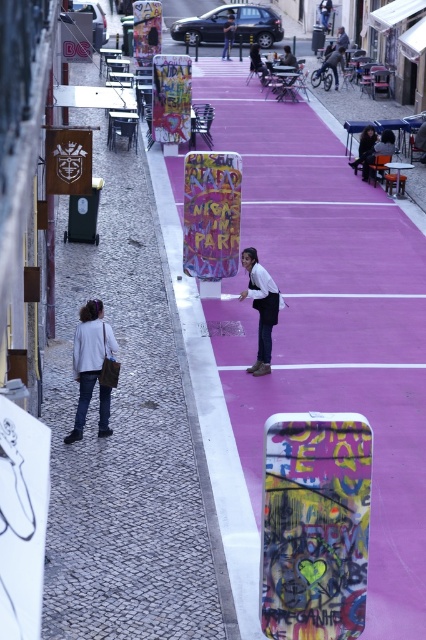
Can you confirm if white shirt at center is shorter than dark blue jeans at center?

Correct, white shirt at center is not as tall as dark blue jeans at center.

Which is in front, point (273, 305) or point (222, 49)?

Positioned in front is point (273, 305).

Which is behind, point (264, 332) or point (227, 32)?

Point (227, 32)

At what (x,y) coordinates should I click in order to perform the action: click on white shirt at center. Please return your answer as a coordinate pair (x, y). The image size is (426, 640). Looking at the image, I should click on (261, 307).

Can you confirm if white matte jacket at lower left is positioned below matte black jacket at upper center?

Correct, white matte jacket at lower left is located below matte black jacket at upper center.

Who is more distant from viewer, (x=89, y=355) or (x=367, y=177)?

Positioned behind is point (x=367, y=177).

This screenshot has height=640, width=426. What are the coordinates of `white matte jacket at lower left` in the screenshot? It's located at (89, 358).

Is point (321, 628) positioned before point (85, 381)?

Yes, point (321, 628) is closer to viewer.

Does graffiti-covered skateboard at center have a greater height compared to white matte jacket at lower left?

Indeed, graffiti-covered skateboard at center has a greater height compared to white matte jacket at lower left.

Identify the location of graffiti-covered skateboard at center. The image size is (426, 640). (314, 525).